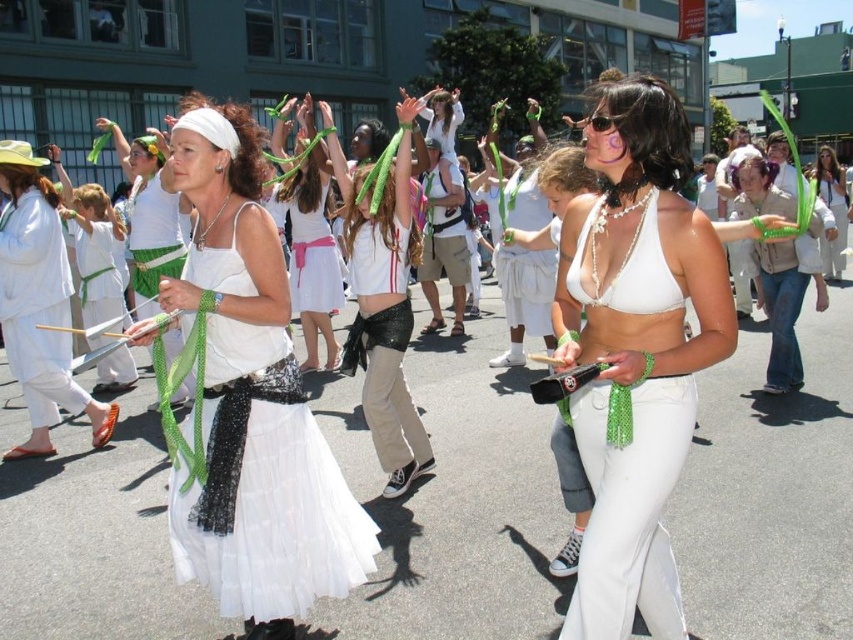
Question: Which is nearer to the white fabric skirt at center?

Choices:
 (A) shiny black skirt at center
 (B) white satin dress at center

Answer: (A)

Question: Among these points, which one is nearest to the camera?

Choices:
 (A) (820, 182)
 (B) (657, 150)
 (C) (583, 224)

Answer: (B)

Question: Which object is positioned closest to the white sequined skirt at center?

Choices:
 (A) white matte bikini top at center
 (B) white satin dress at center
 (C) white fabric skirt at center

Answer: (B)

Question: Does shiny black skirt at center lie behind white sequined skirt at center?

Choices:
 (A) no
 (B) yes

Answer: (A)

Question: Observing the image, what is the correct spatial positioning of white satin dress at center in reference to white fabric skirt at center?

Choices:
 (A) right
 (B) left

Answer: (B)

Question: Is pearl white bikini top at center positioned before white satin dress at center?

Choices:
 (A) yes
 (B) no

Answer: (A)